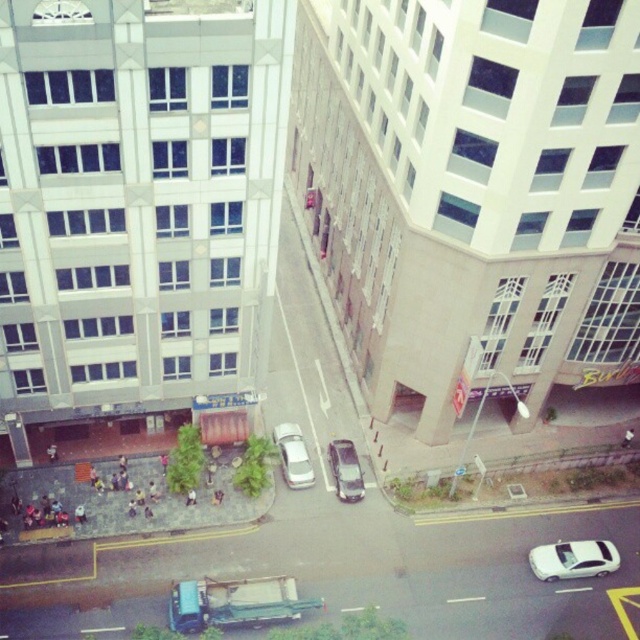
You are a delivery driver planning to park your vehicle in this area. You have two options for parking spots near the white matte car at lower right and the white matte car at center. Which parking spot would allow your vehicle to fit better based on their sizes?

The white matte car at center is taller than the white matte car at lower right, so the parking spot near the white matte car at center would be more suitable if your vehicle requires more vertical space.

You are a delivery person who needs to park between the white matte car at lower right and the white matte car at center. Given that your van is 2 meters wide, can you fit between them?

The white matte car at lower right is wider than the white matte car at center. Since the space between them depends on their widths, but the exact distance isn

You are a delivery person trying to park your 2.5 meter wide truck in the parking lot. You see the white matte car at lower right and the satin silver car at center. Which car has a larger width?

The white matte car at lower right has a larger width than the satin silver car at center according to the description, so the truck driver should consider the space needed for the white matte car at lower right which is wider.